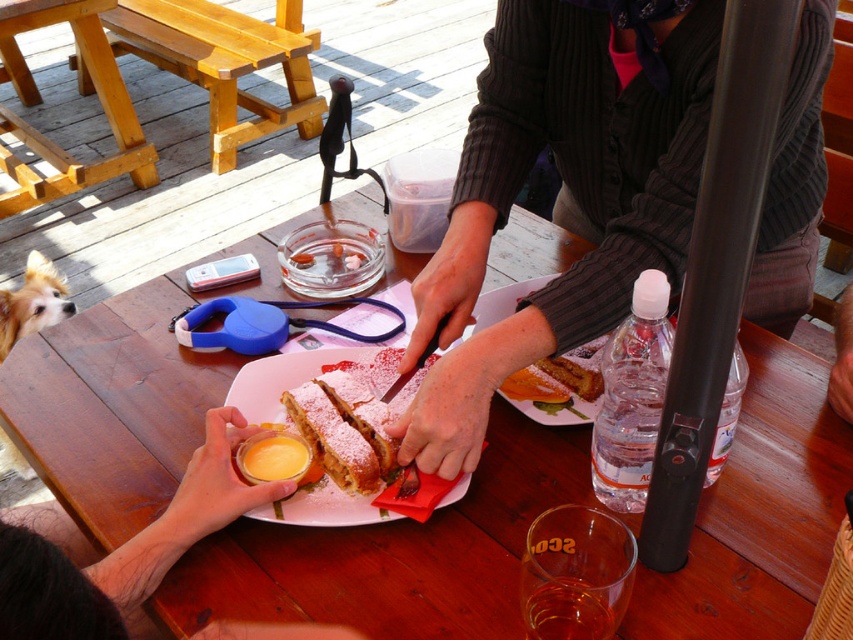
You are a photographer taking a picture of the scene. You notice two dogs labeled as fuzzy brown dog at lower left and brown fur dog at lower left. Which dog is positioned lower in the image?

The fuzzy brown dog at lower left is positioned lower than the brown fur dog at lower left in the image.

You are standing at the edge of the wooden deck and want to walk to the point marked at coordinates (563, 192). Which object is located at that point?

The point marked at coordinates (563, 192) is on the dark ribbed sweater at center.